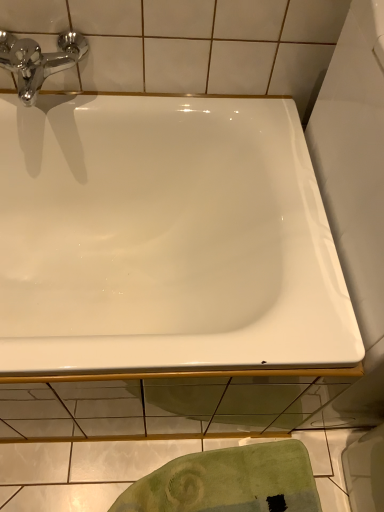
Question: Is green textured towel at lower center further to the viewer compared to white glossy bathtub at center?

Choices:
 (A) no
 (B) yes

Answer: (B)

Question: Is green textured towel at lower center closer to camera compared to white glossy bathtub at center?

Choices:
 (A) yes
 (B) no

Answer: (B)

Question: Is green textured towel at lower center completely or partially outside of white glossy bathtub at center?

Choices:
 (A) yes
 (B) no

Answer: (A)

Question: Can you confirm if green textured towel at lower center is wider than white glossy bathtub at center?

Choices:
 (A) no
 (B) yes

Answer: (A)

Question: Does green textured towel at lower center have a smaller size compared to white glossy bathtub at center?

Choices:
 (A) yes
 (B) no

Answer: (A)

Question: Is green textured towel at lower center wider or thinner than white glossy bathtub at center?

Choices:
 (A) thin
 (B) wide

Answer: (A)

Question: Considering the positions of green textured towel at lower center and white glossy bathtub at center in the image, is green textured towel at lower center bigger or smaller than white glossy bathtub at center?

Choices:
 (A) big
 (B) small

Answer: (B)

Question: Considering the positions of point (152, 478) and point (31, 367), is point (152, 478) closer or farther from the camera than point (31, 367)?

Choices:
 (A) farther
 (B) closer

Answer: (A)

Question: Would you say green textured towel at lower center is to the left or to the right of white glossy bathtub at center in the picture?

Choices:
 (A) left
 (B) right

Answer: (B)

Question: Looking at the image, does chrome/metallic faucet at upper left seem bigger or smaller compared to green textured towel at lower center?

Choices:
 (A) big
 (B) small

Answer: (B)

Question: Looking at their shapes, would you say chrome/metallic faucet at upper left is wider or thinner than green textured towel at lower center?

Choices:
 (A) wide
 (B) thin

Answer: (A)

Question: Is point (21, 59) positioned closer to the camera than point (172, 480)?

Choices:
 (A) closer
 (B) farther

Answer: (A)

Question: In terms of height, does chrome/metallic faucet at upper left look taller or shorter compared to green textured towel at lower center?

Choices:
 (A) tall
 (B) short

Answer: (A)

Question: From the image's perspective, is white glossy bathtub at center positioned above or below green textured towel at lower center?

Choices:
 (A) below
 (B) above

Answer: (B)

Question: Is white glossy bathtub at center to the left or to the right of green textured towel at lower center in the image?

Choices:
 (A) left
 (B) right

Answer: (A)